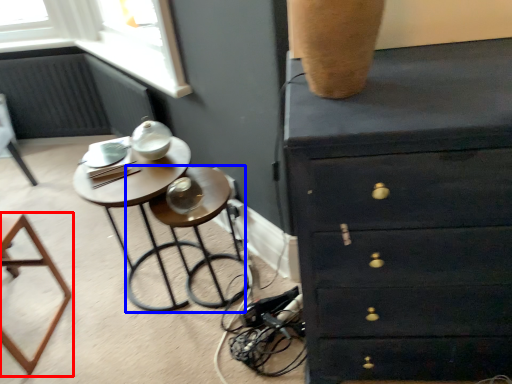
Question: Among these objects, which one is nearest to the camera, furniture (highlighted by a red box) or bar stool (highlighted by a blue box)?

Choices:
 (A) furniture
 (B) bar stool

Answer: (A)